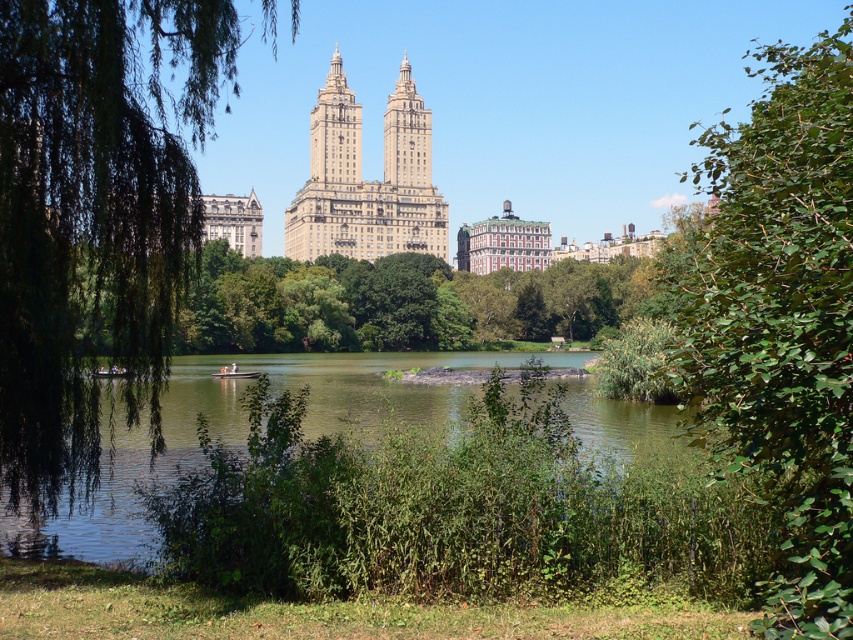
Can you confirm if beige stone building at center is positioned above wooden boat at center?

Yes, beige stone building at center is above wooden boat at center.

Image resolution: width=853 pixels, height=640 pixels. Describe the element at coordinates (367, 180) in the screenshot. I see `beige stone building at center` at that location.

Between point (398, 147) and point (230, 371), which one is positioned behind?

Positioned behind is point (398, 147).

The height and width of the screenshot is (640, 853). Identify the location of beige stone building at center. (367, 180).

Consider the image. Does green grassy river at center have a larger size compared to green leafy tree at center?

Correct, green grassy river at center is larger in size than green leafy tree at center.

Which is more to the left, green grassy river at center or green leafy tree at center?

green grassy river at center

Who is more forward, (245, 387) or (486, 326)?

Point (245, 387)

Where is `green grassy river at center`? The width and height of the screenshot is (853, 640). green grassy river at center is located at coordinates (245, 433).

Between green leafy tree at center and beige stone building at center, which one has more height?

Standing taller between the two is beige stone building at center.

Is point (347, 321) positioned in front of point (352, 182)?

Yes, point (347, 321) is in front of point (352, 182).

Find the location of a particular element. green leafy tree at center is located at coordinates (397, 304).